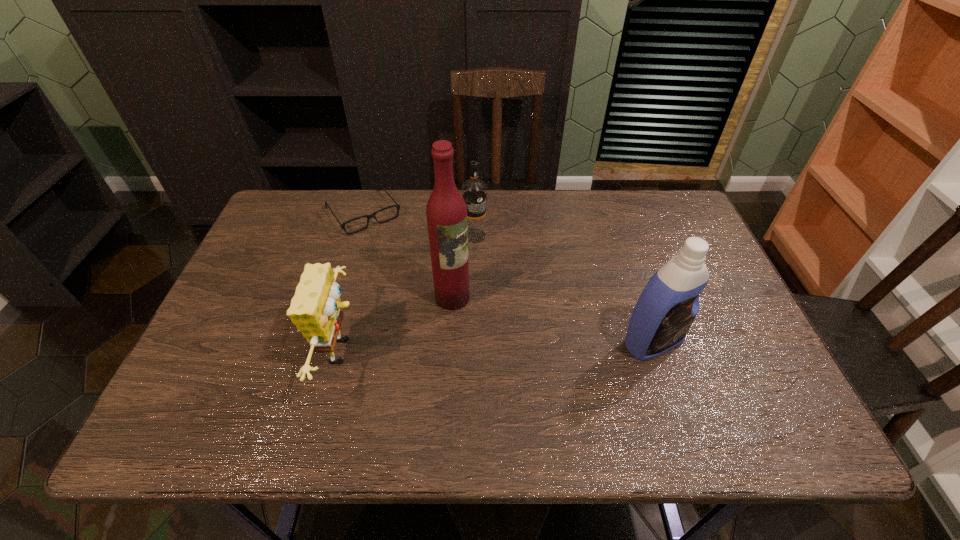
Where is `free space located on the front-facing side of the spectacles`? Image resolution: width=960 pixels, height=540 pixels. free space located on the front-facing side of the spectacles is located at coordinates (400, 262).

In order to click on free point located on the label of the tallest object in this screenshot , I will do `click(559, 392)`.

This screenshot has width=960, height=540. I want to click on vacant region located 0.310m on the label of the tallest object, so click(x=556, y=389).

Find the location of a particular element. This screenshot has width=960, height=540. vacant space located on the label of the tallest object is located at coordinates [559, 392].

Image resolution: width=960 pixels, height=540 pixels. I want to click on vacant space situated 0.150m on the label of the vodka, so click(x=496, y=279).

At what (x,y) coordinates should I click in order to perform the action: click on free space located on the label of the vodka. Please return your answer as a coordinate pair (x, y). Looking at the image, I should click on (515, 314).

The height and width of the screenshot is (540, 960). Find the location of `free region located 0.070m on the label of the vodka`. free region located 0.070m on the label of the vodka is located at coordinates [487, 259].

The height and width of the screenshot is (540, 960). Identify the location of spectacles that is at the far edge. (397, 206).

At what (x,y) coordinates should I click in order to perform the action: click on vodka that is at the far edge. Please return your answer as a coordinate pair (x, y). The image size is (960, 540). Looking at the image, I should click on (474, 191).

Where is `object at the near edge`? object at the near edge is located at coordinates (316, 309).